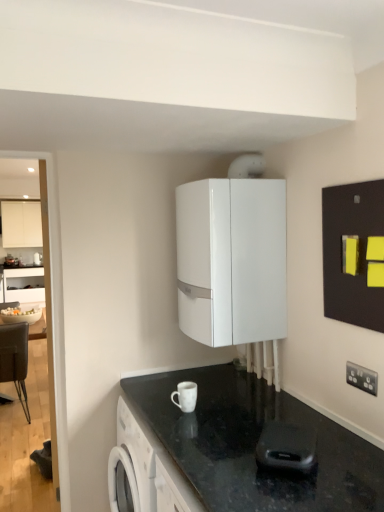
The height and width of the screenshot is (512, 384). What are the coordinates of `free location to the right of black rubber remote control at lower center, arranged as the first appliance when viewed from the front` in the screenshot? It's located at (342, 467).